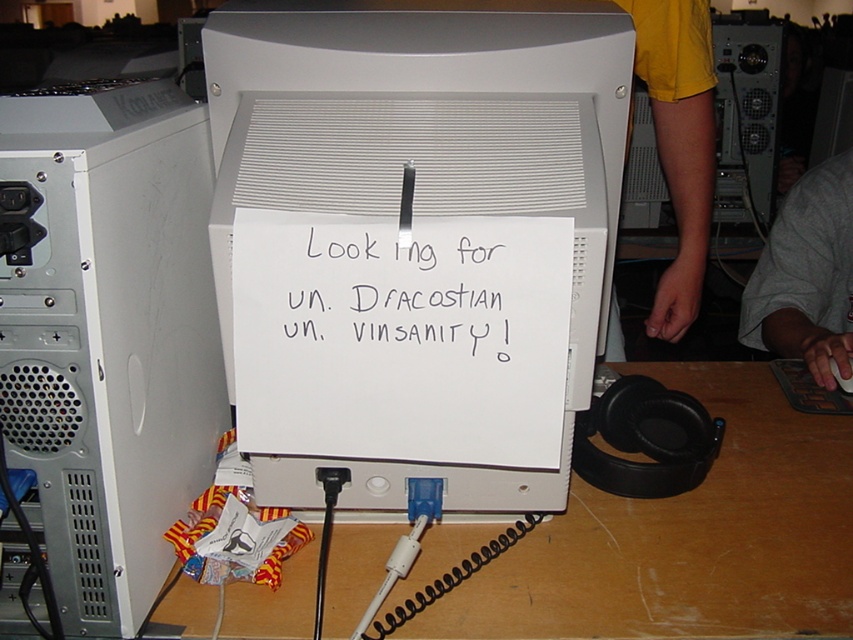
Can you confirm if white plastic monitor at center is positioned below white paper at center?

No.

Is point (289, 140) more distant than point (444, 298)?

Yes, point (289, 140) is farther from viewer.

Image resolution: width=853 pixels, height=640 pixels. What are the coordinates of `white plastic monitor at center` in the screenshot? It's located at (416, 156).

Can you confirm if wooden table at lower center is shorter than white paper at center?

In fact, wooden table at lower center may be taller than white paper at center.

Which of these two, wooden table at lower center or white paper at center, stands shorter?

white paper at center is shorter.

Describe the element at coordinates (688, 538) in the screenshot. This screenshot has width=853, height=640. I see `wooden table at lower center` at that location.

Locate an element on the screen. The width and height of the screenshot is (853, 640). wooden table at lower center is located at coordinates (688, 538).

Is silver metallic desktop computer at left above wooden table at lower center?

Correct, silver metallic desktop computer at left is located above wooden table at lower center.

Does point (64, 564) come behind point (181, 604)?

That is False.

Where is `silver metallic desktop computer at left`? Image resolution: width=853 pixels, height=640 pixels. silver metallic desktop computer at left is located at coordinates (107, 332).